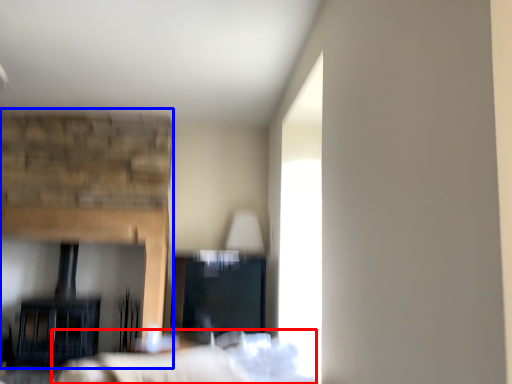
Question: Which of the following is the farthest to the observer, bed (highlighted by a red box) or fireplace (highlighted by a blue box)?

Choices:
 (A) bed
 (B) fireplace

Answer: (B)